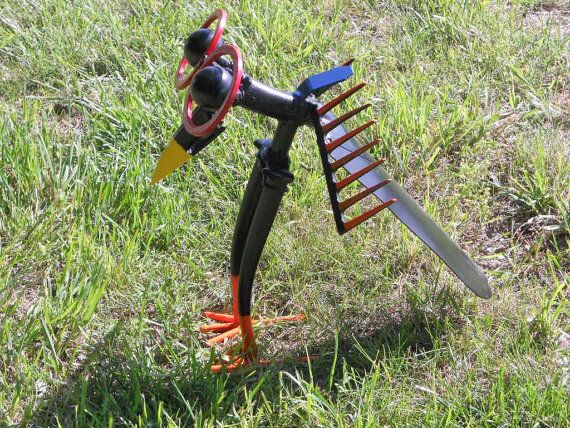
Where is `handles`? Image resolution: width=570 pixels, height=428 pixels. handles is located at coordinates (195, 83), (197, 35).